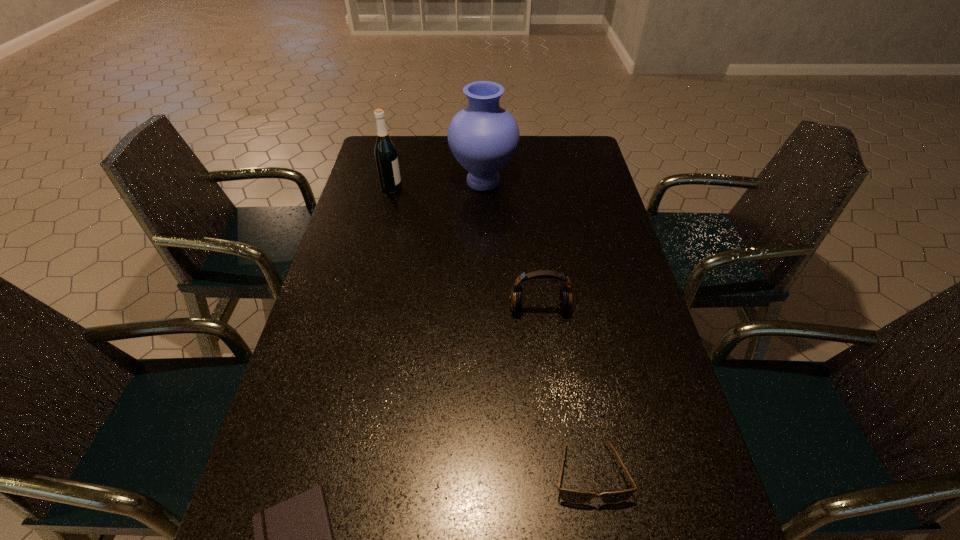
This screenshot has width=960, height=540. I want to click on object located at the left edge, so click(x=385, y=152).

Find the location of a particular element. Image resolution: width=960 pixels, height=540 pixels. object that is at the right edge is located at coordinates (570, 496).

This screenshot has height=540, width=960. Find the location of `vacant space at the far edge of the desktop`. vacant space at the far edge of the desktop is located at coordinates (523, 148).

In the image, there is a desktop. Where is `vacant space at the left edge`? The height and width of the screenshot is (540, 960). vacant space at the left edge is located at coordinates (321, 314).

The height and width of the screenshot is (540, 960). In order to click on free space at the right edge in this screenshot , I will do `click(617, 259)`.

Find the location of a particular element. vacant position at the far right corner of the desktop is located at coordinates (576, 139).

This screenshot has width=960, height=540. I want to click on free spot between the vase and the fourth tallest object, so click(x=537, y=327).

You are a GUI agent. You are given a task and a screenshot of the screen. Output one action in this format:
    pyautogui.click(x=<x>, y=<y>)
    Task: Click on the vacant area that lies between the vase and the second shortest object
    This screenshot has height=540, width=960.
    Given the screenshot: What is the action you would take?
    pyautogui.click(x=537, y=327)

Where is `free spot between the wine bottle and the third tallest object`? This screenshot has width=960, height=540. free spot between the wine bottle and the third tallest object is located at coordinates (466, 248).

The width and height of the screenshot is (960, 540). I want to click on free space that is in between the sunglasses and the vase, so click(x=537, y=327).